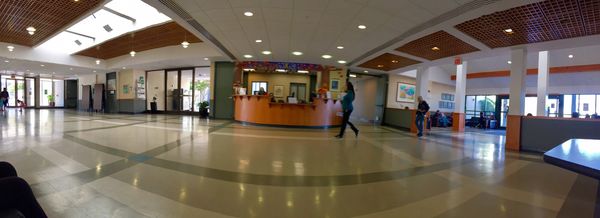
The width and height of the screenshot is (600, 218). I want to click on skylights, so click(x=92, y=23).